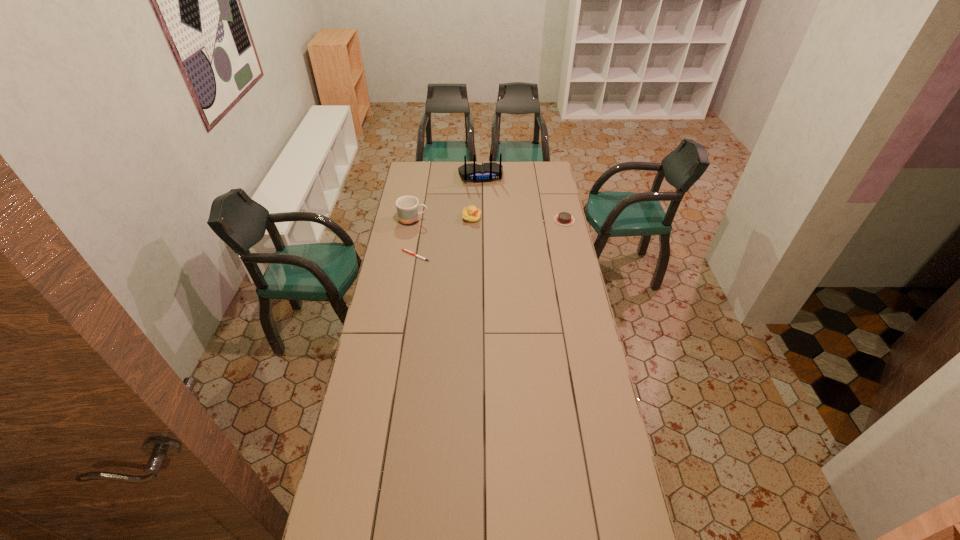
Where is `object present at the far edge`? The width and height of the screenshot is (960, 540). object present at the far edge is located at coordinates (486, 172).

This screenshot has height=540, width=960. Identify the location of pen at the left edge. (405, 250).

Find the location of a particular element. The height and width of the screenshot is (540, 960). mug present at the left edge is located at coordinates (407, 207).

The image size is (960, 540). Identify the location of object that is at the right edge. (564, 218).

Where is `vacant space at the far edge`? Image resolution: width=960 pixels, height=540 pixels. vacant space at the far edge is located at coordinates (509, 173).

In the image, there is a desktop. At what (x,y) coordinates should I click in order to perform the action: click on free space at the left edge. Please return your answer as a coordinate pair (x, y). Looking at the image, I should click on (428, 191).

The width and height of the screenshot is (960, 540). In the image, there is a desktop. Identify the location of vacant space at the right edge. 572,403.

The height and width of the screenshot is (540, 960). Identify the location of free region at the far left corner of the desktop. (408, 164).

In order to click on empty space between the nearest object and the second tallest object in this screenshot , I will do `click(415, 238)`.

Locate an element on the screen. The width and height of the screenshot is (960, 540). empty location between the router and the rightmost object is located at coordinates (522, 198).